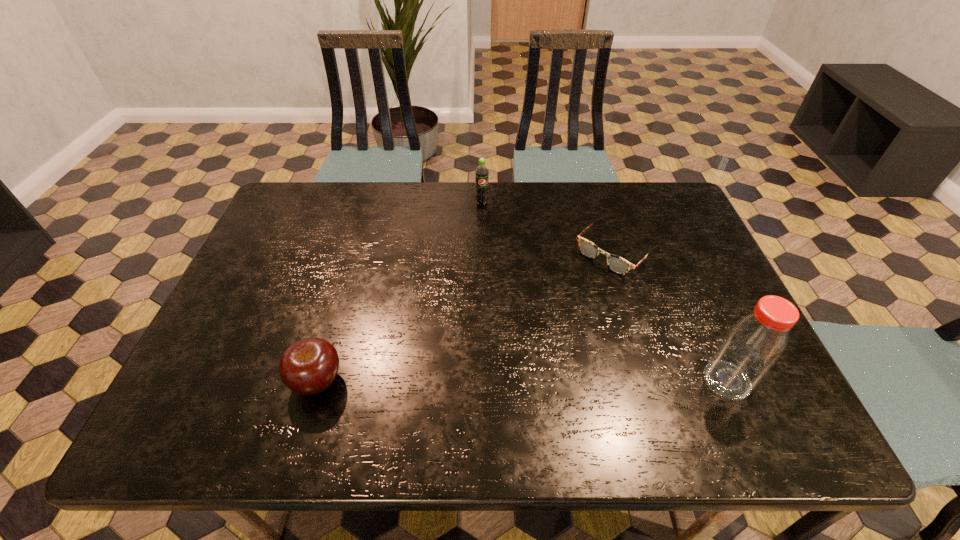
Identify the location of spectacles that is at the right edge. (617, 264).

Identify the location of object present at the far right corner. The image size is (960, 540). (617, 264).

You are a GUI agent. You are given a task and a screenshot of the screen. Output one action in this format:
    pyautogui.click(x=<x>, y=<y>)
    Task: Click on the object that is at the near right corner
    
    Given the screenshot: What is the action you would take?
    pyautogui.click(x=752, y=346)

At what (x,y) coordinates should I click in order to perform the action: click on free region at the far edge of the desktop. Please return your answer as a coordinate pair (x, y). Looking at the image, I should click on (567, 217).

Identify the location of free space at the near edge of the desktop. (563, 396).

Image resolution: width=960 pixels, height=540 pixels. I want to click on vacant area at the left edge, so click(x=265, y=246).

In the image, there is a desktop. Where is `vacant space at the right edge`? This screenshot has height=540, width=960. vacant space at the right edge is located at coordinates (661, 229).

Find the location of a particular element. vacant space at the far left corner of the desktop is located at coordinates (296, 228).

The image size is (960, 540). I want to click on free spot at the far right corner of the desktop, so click(623, 184).

This screenshot has width=960, height=540. Identify the location of vacant area that lies between the second object from left to right and the second shortest object. (399, 292).